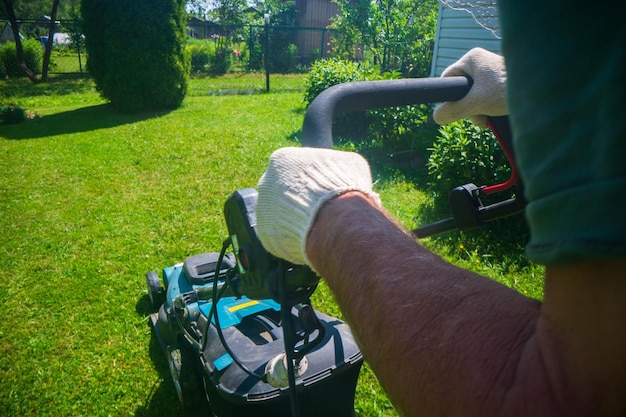
At what (x,y) coordinates should I click in order to perform the action: click on handle. Please return your answer as a coordinate pair (x, y). The height and width of the screenshot is (417, 626). Looking at the image, I should click on (374, 86).